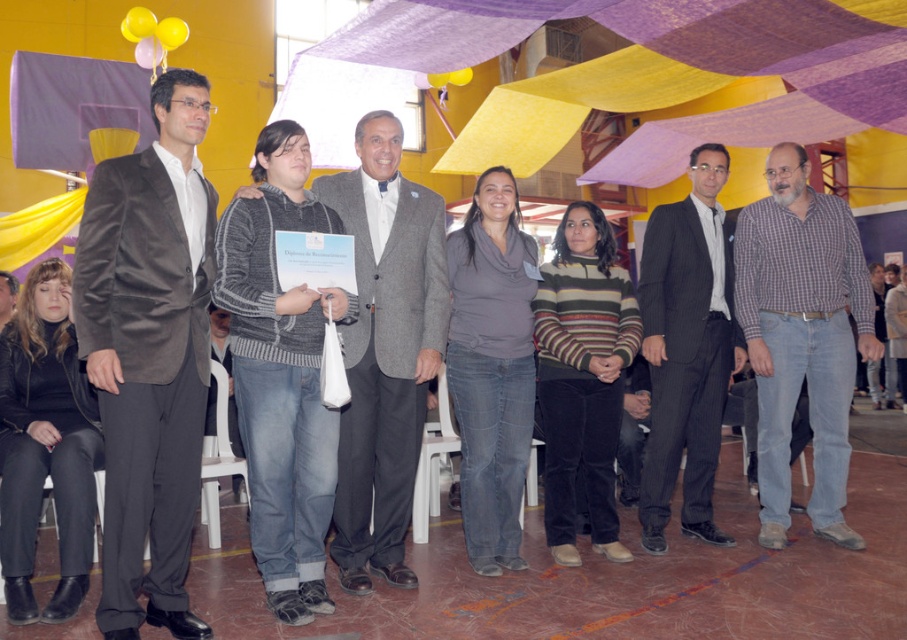
Find the location of `velvet brown blazer at center`. velvet brown blazer at center is located at coordinates (149, 355).

From the picture: Can you confirm if velvet brown blazer at center is wider than gray sweater at center?

Incorrect, velvet brown blazer at center's width does not surpass gray sweater at center's.

Is point (164, 528) in front of point (386, 468)?

Yes, point (164, 528) is in front of point (386, 468).

This screenshot has height=640, width=907. What are the coordinates of `velvet brown blazer at center` in the screenshot? It's located at (149, 355).

Who is shorter, knitted sweater at center or plaid cotton shirt at right?

knitted sweater at center is shorter.

Find the location of a particular element. This screenshot has height=640, width=907. knitted sweater at center is located at coordinates (281, 374).

Identify the location of knitted sweater at center. (281, 374).

Between point (304, 493) and point (31, 596), which one is positioned behind?

Point (304, 493)

Measure the distance from knitted sweater at center to black leather jacket at lower left.

The distance of knitted sweater at center from black leather jacket at lower left is 37.59 inches.

In the scene shown: Who is more forward, (239, 336) or (45, 609)?

Point (45, 609) is more forward.

Find the location of `knitted sweater at center`. knitted sweater at center is located at coordinates (281, 374).